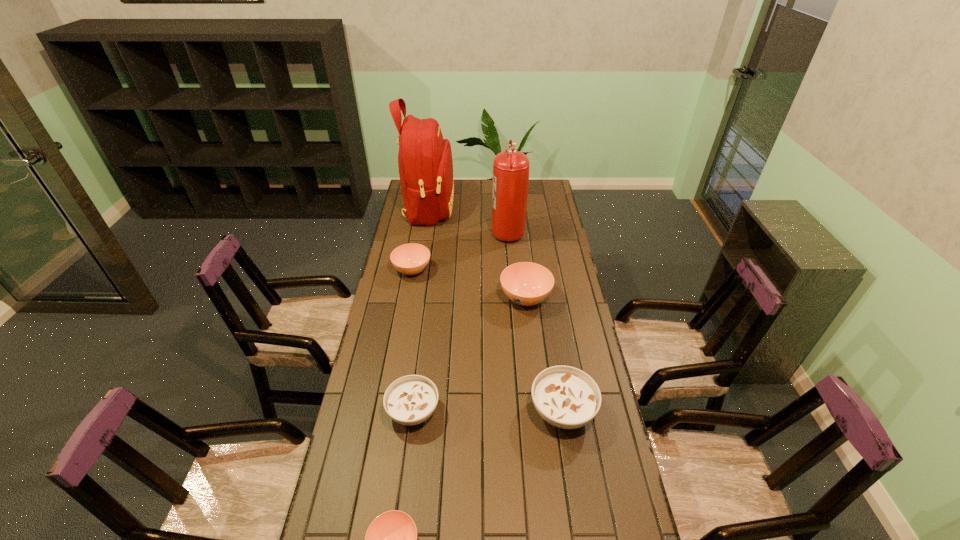
You are a GUI agent. You are given a task and a screenshot of the screen. Output one action in this format:
    pyautogui.click(x=<x>, y=<y>)
    Task: Click on the white soup bowl that is the second nearest to the second biggest peach soup bowl
    This screenshot has width=960, height=540.
    Given the screenshot: What is the action you would take?
    pyautogui.click(x=566, y=397)

In order to click on blank area in the image that satisfies the following two spatial constraints: 1. on the back side of the bigger white soup bowl; 2. on the front-facing side of the pink backpack in this screenshot , I will do `click(530, 207)`.

This screenshot has height=540, width=960. Find the location of `vacant space that satisfies the following two spatial constraints: 1. on the front-facing side of the pink backpack; 2. on the right side of the bigger white soup bowl`. vacant space that satisfies the following two spatial constraints: 1. on the front-facing side of the pink backpack; 2. on the right side of the bigger white soup bowl is located at coordinates (396, 411).